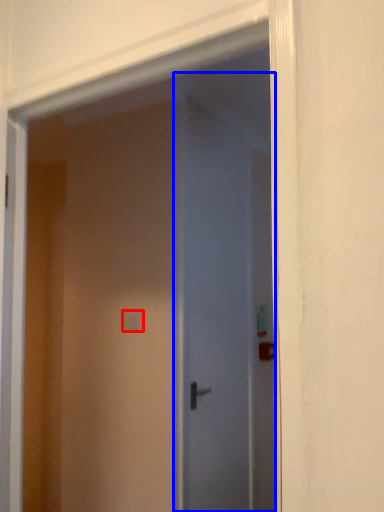
Question: Which object is closer to the camera taking this photo, light switch (highlighted by a red box) or door (highlighted by a blue box)?

Choices:
 (A) light switch
 (B) door

Answer: (B)